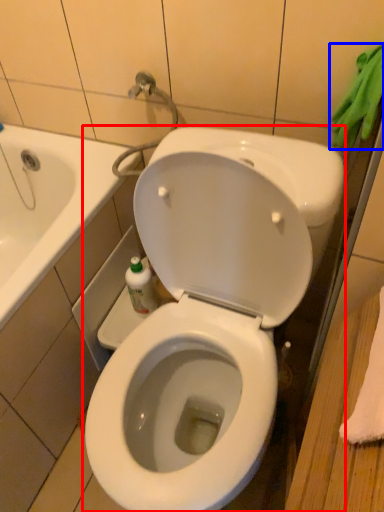
Question: Which object appears farthest to the camera in this image, toilet (highlighted by a red box) or bath towel (highlighted by a blue box)?

Choices:
 (A) toilet
 (B) bath towel

Answer: (B)